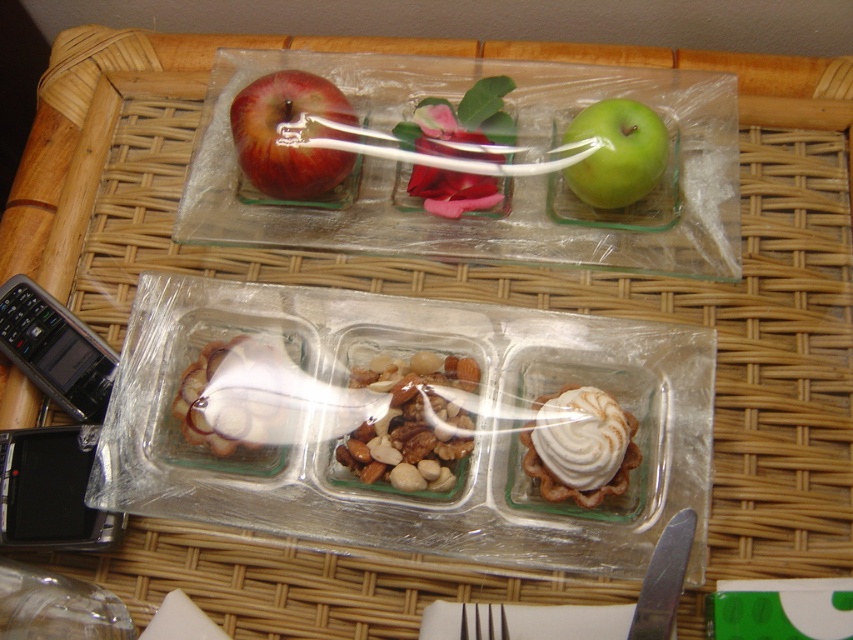
Question: Which of the following is the closest to the observer?

Choices:
 (A) shiny red apple at upper left
 (B) whipped cream pastry at center right
 (C) green matte apple at upper right
 (D) shiny brown nuts at center

Answer: (B)

Question: Is shiny red apple at upper left bigger than whipped cream pastry at center right?

Choices:
 (A) no
 (B) yes

Answer: (B)

Question: Which point is closer to the camera taking this photo?

Choices:
 (A) (593, 392)
 (B) (575, 188)
 (C) (399, 467)
 (D) (242, 156)

Answer: (A)

Question: Is whipped cream pastry at center right below green matte apple at upper right?

Choices:
 (A) yes
 (B) no

Answer: (A)

Question: Does shiny red apple at upper left have a smaller size compared to green matte apple at upper right?

Choices:
 (A) yes
 (B) no

Answer: (B)

Question: Based on their relative distances, which object is nearer to the whipped cream pastry at center right?

Choices:
 (A) green matte apple at upper right
 (B) shiny brown nuts at center
 (C) shiny red apple at upper left

Answer: (B)